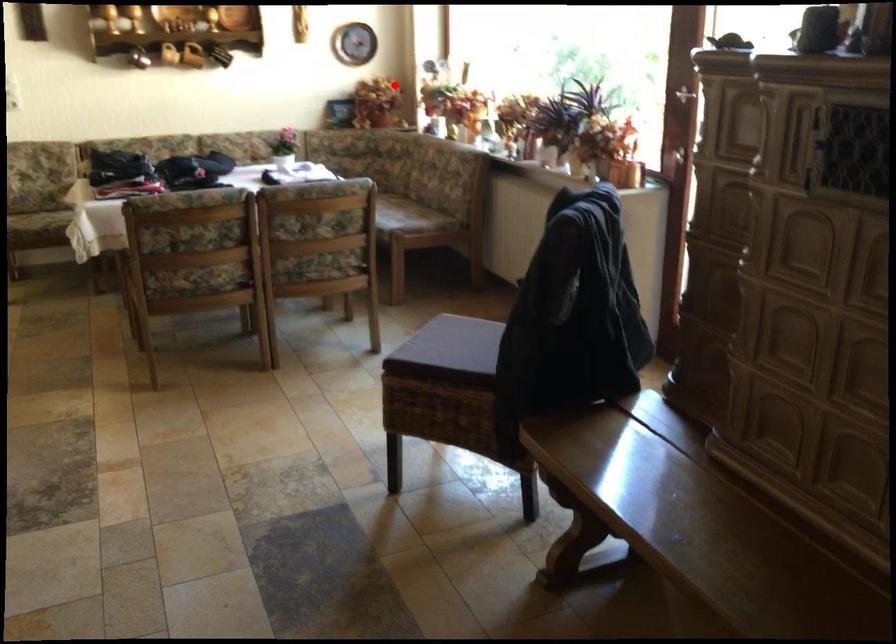
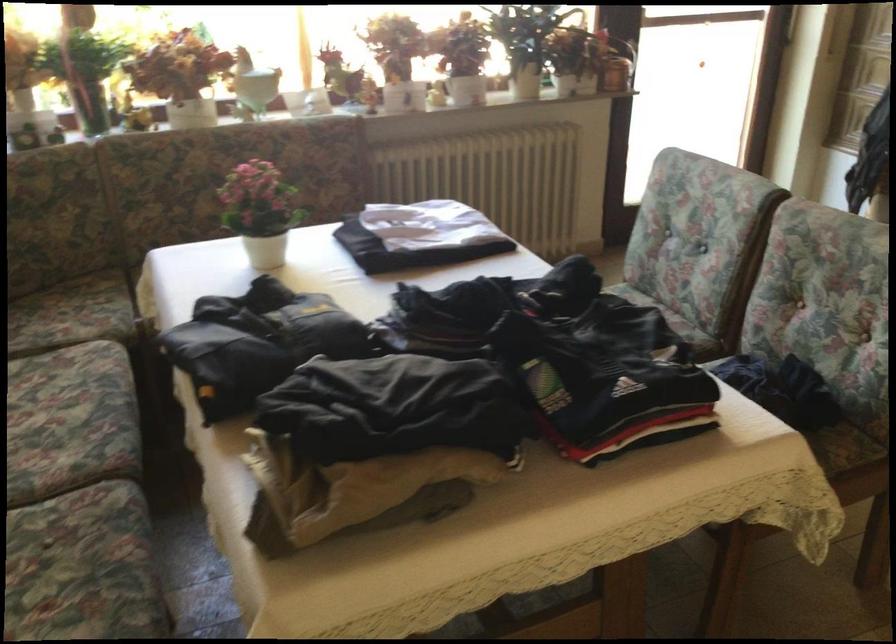
Locate, in the second image, the point that corresponds to the highlighted location in the first image.

(83, 71)